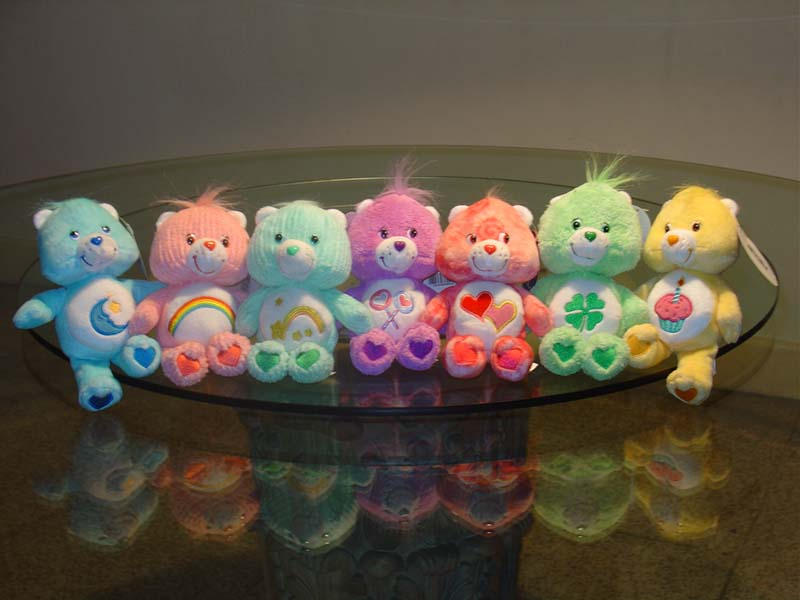
Locate an element on the screen. The height and width of the screenshot is (600, 800). pink and red hearts decoration is located at coordinates [x=478, y=306].